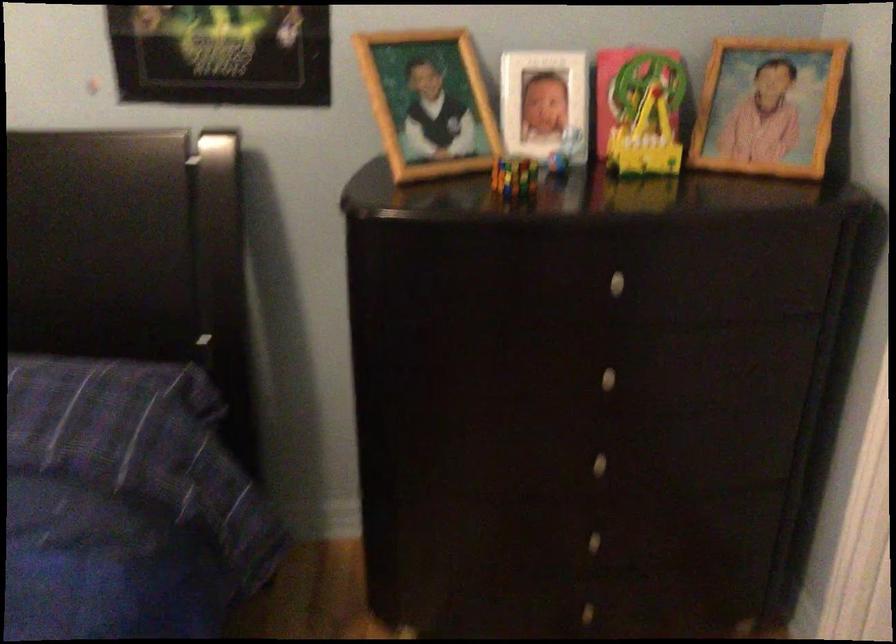
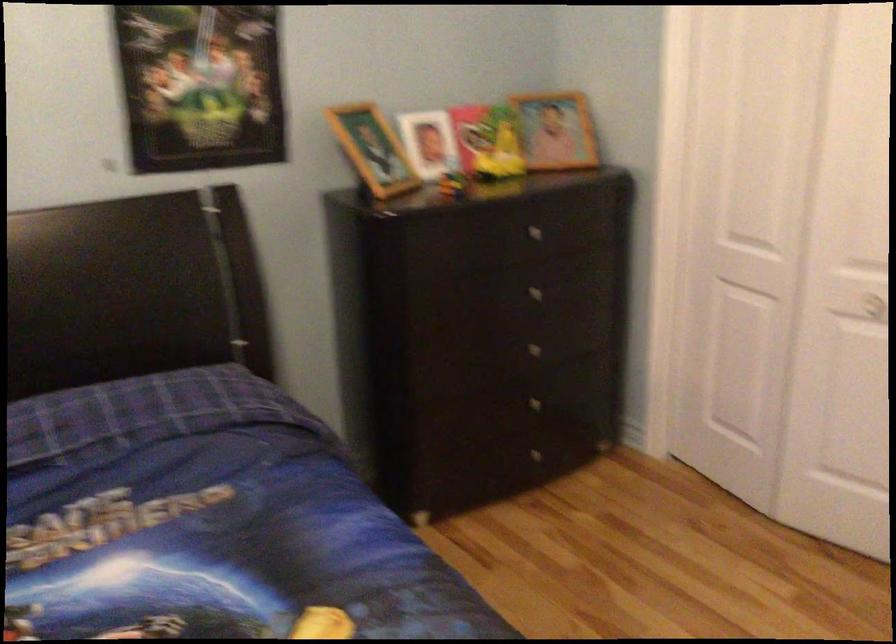
The point at (770, 114) is marked in the first image. Where is the corresponding point in the second image?

(556, 129)